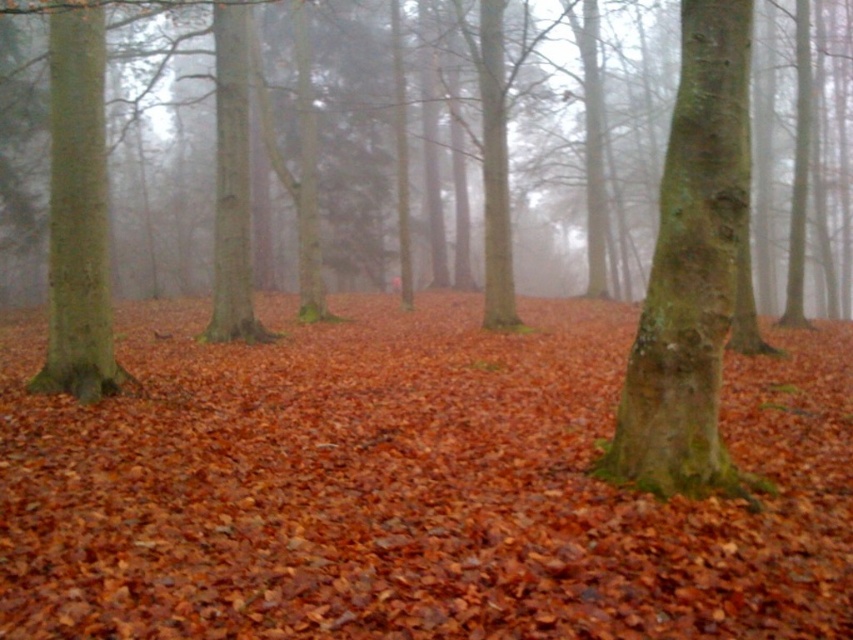
You are a hiker who wants to place a 10 feet long wooden bench between the leaves at center and the green rough bark tree at center. Is there enough space for the bench?

The distance between the leaves at center and the green rough bark tree at center is 16.81 feet, so yes, there is enough space to place a 10 feet long wooden bench between them.

You are a hiker who wants to take a photo of the leaves at center and the green rough bark tree at left. Based on their positions, which one would appear larger in the photo?

The green rough bark tree at left would appear larger in the photo because it has a greater height than the leaves at center.